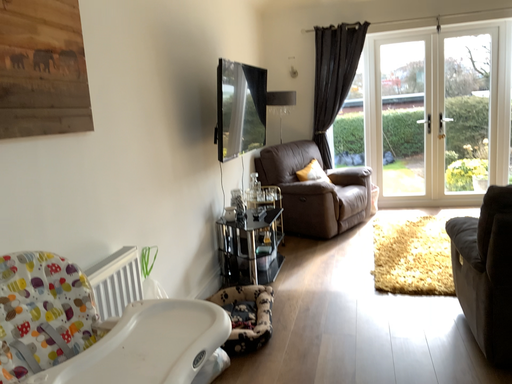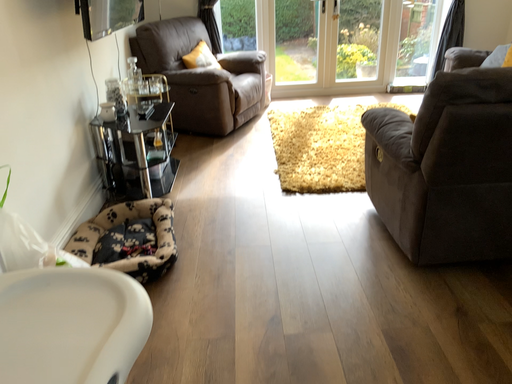
Question: How did the camera likely rotate when shooting the video?

Choices:
 (A) rotated downward
 (B) rotated upward

Answer: (A)